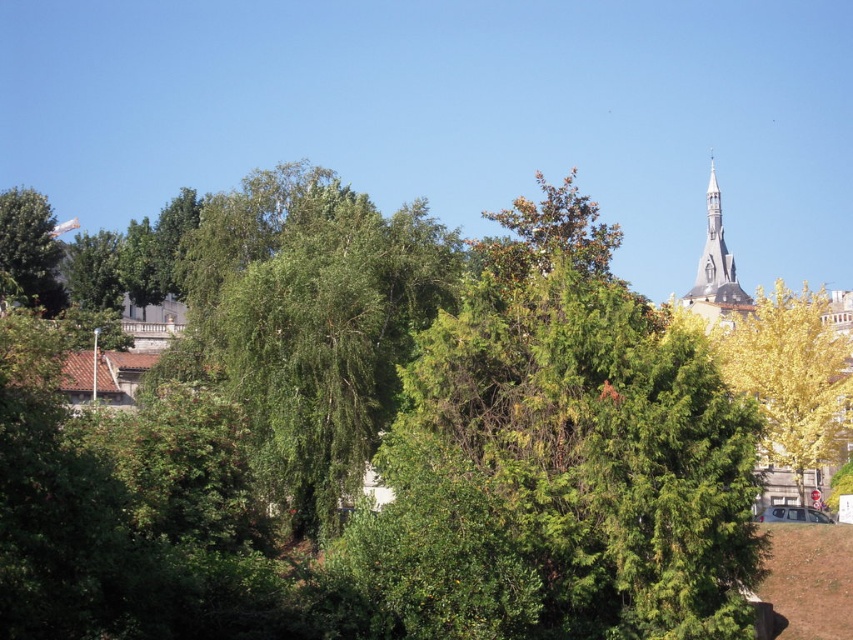
Does point (804, 352) come farther from viewer compared to point (42, 296)?

No, (804, 352) is in front of (42, 296).

Looking at this image, which is more to the right, yellow/golden leaves at upper right or green leafy tree at upper left?

Positioned to the right is yellow/golden leaves at upper right.

You are a GUI agent. You are given a task and a screenshot of the screen. Output one action in this format:
    pyautogui.click(x=<x>, y=<y>)
    Task: Click on the yellow/golden leaves at upper right
    
    Given the screenshot: What is the action you would take?
    pyautogui.click(x=790, y=376)

Who is lower down, green leafy tree at upper left or smooth gray stone tower at upper right?

smooth gray stone tower at upper right

Is green leafy tree at upper left wider than smooth gray stone tower at upper right?

In fact, green leafy tree at upper left might be narrower than smooth gray stone tower at upper right.

Which is behind, point (16, 273) or point (693, 307)?

Positioned behind is point (693, 307).

Locate an element on the screen. Image resolution: width=853 pixels, height=640 pixels. green leafy tree at upper left is located at coordinates (28, 250).

Between yellow/golden leaves at upper right and smooth gray stone tower at upper right, which one appears on the left side from the viewer's perspective?

From the viewer's perspective, yellow/golden leaves at upper right appears more on the left side.

Is yellow/golden leaves at upper right closer to camera compared to smooth gray stone tower at upper right?

Yes, it is.

Image resolution: width=853 pixels, height=640 pixels. What do you see at coordinates (790, 376) in the screenshot?
I see `yellow/golden leaves at upper right` at bounding box center [790, 376].

The height and width of the screenshot is (640, 853). I want to click on yellow/golden leaves at upper right, so click(x=790, y=376).